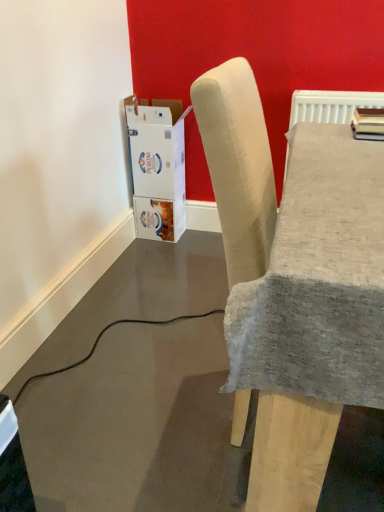
Question: Considering the relative positions of beige fabric chair at center and white cardboard box at lower left in the image provided, is beige fabric chair at center to the right of white cardboard box at lower left from the viewer's perspective?

Choices:
 (A) no
 (B) yes

Answer: (B)

Question: Is beige fabric chair at center aimed at white cardboard box at lower left?

Choices:
 (A) no
 (B) yes

Answer: (A)

Question: Is beige fabric chair at center at the left side of white cardboard box at lower left?

Choices:
 (A) yes
 (B) no

Answer: (B)

Question: From the image's perspective, is beige fabric chair at center on top of white cardboard box at lower left?

Choices:
 (A) yes
 (B) no

Answer: (B)

Question: Is white cardboard box at lower left completely or partially inside beige fabric chair at center?

Choices:
 (A) no
 (B) yes

Answer: (A)

Question: Is beige fabric chair at center in front of white cardboard box at lower left?

Choices:
 (A) yes
 (B) no

Answer: (A)

Question: Is the position of white cardboard box at lower left less distant than that of beige fabric chair at center?

Choices:
 (A) no
 (B) yes

Answer: (A)

Question: Considering the relative sizes of white cardboard box at lower left and beige fabric chair at center in the image provided, is white cardboard box at lower left shorter than beige fabric chair at center?

Choices:
 (A) yes
 (B) no

Answer: (A)

Question: From the image's perspective, is white cardboard box at lower left over beige fabric chair at center?

Choices:
 (A) no
 (B) yes

Answer: (B)

Question: Does white cardboard box at lower left have a greater height compared to beige fabric chair at center?

Choices:
 (A) yes
 (B) no

Answer: (B)

Question: Can you confirm if white cardboard box at lower left is wider than beige fabric chair at center?

Choices:
 (A) no
 (B) yes

Answer: (A)

Question: Is white cardboard box at lower left facing away from beige fabric chair at center?

Choices:
 (A) yes
 (B) no

Answer: (B)

Question: Considering the positions of white cardboard box at lower left and beige fabric chair at center in the image, is white cardboard box at lower left wider or thinner than beige fabric chair at center?

Choices:
 (A) thin
 (B) wide

Answer: (A)